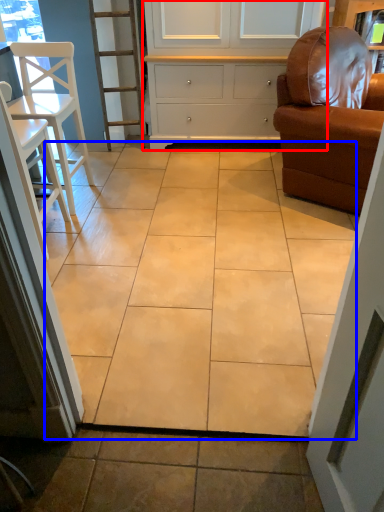
Question: Which object appears farthest to the camera in this image, cabinetry (highlighted by a red box) or ceramic tile (highlighted by a blue box)?

Choices:
 (A) cabinetry
 (B) ceramic tile

Answer: (A)